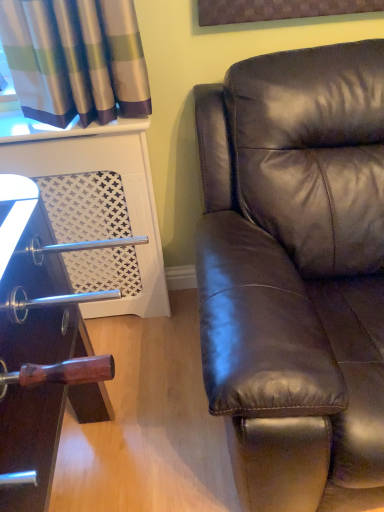
Image resolution: width=384 pixels, height=512 pixels. What do you see at coordinates (296, 273) in the screenshot? I see `brown leather couch at upper right` at bounding box center [296, 273].

Where is `brown leather couch at upper right`? The height and width of the screenshot is (512, 384). brown leather couch at upper right is located at coordinates (296, 273).

Locate an element on the screen. The height and width of the screenshot is (512, 384). brown leather couch at upper right is located at coordinates tap(296, 273).